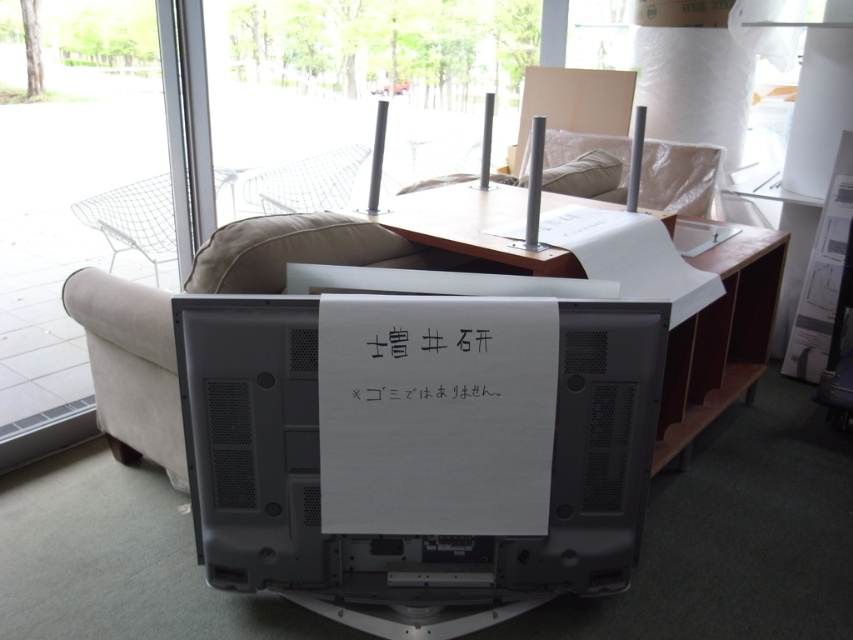
Question: Does white fabric couch at center appear under clear wire mesh chair at center?

Choices:
 (A) no
 (B) yes

Answer: (B)

Question: Based on their relative distances, which object is farther from the white fabric couch at center?

Choices:
 (A) wooden table at center
 (B) white paper at center
 (C) beige fabric pillow at upper center

Answer: (B)

Question: Does white fabric couch at center appear on the left side of clear wire mesh chair at center?

Choices:
 (A) no
 (B) yes

Answer: (A)

Question: Which object appears farthest from the camera in this image?

Choices:
 (A) white fabric couch at center
 (B) satin black monitor at center

Answer: (A)

Question: Is satin black monitor at center above white fabric couch at center?

Choices:
 (A) no
 (B) yes

Answer: (A)

Question: Which of the following is the closest to the observer?

Choices:
 (A) wooden table at center
 (B) beige fabric pillow at upper center
 (C) white paper at center

Answer: (C)